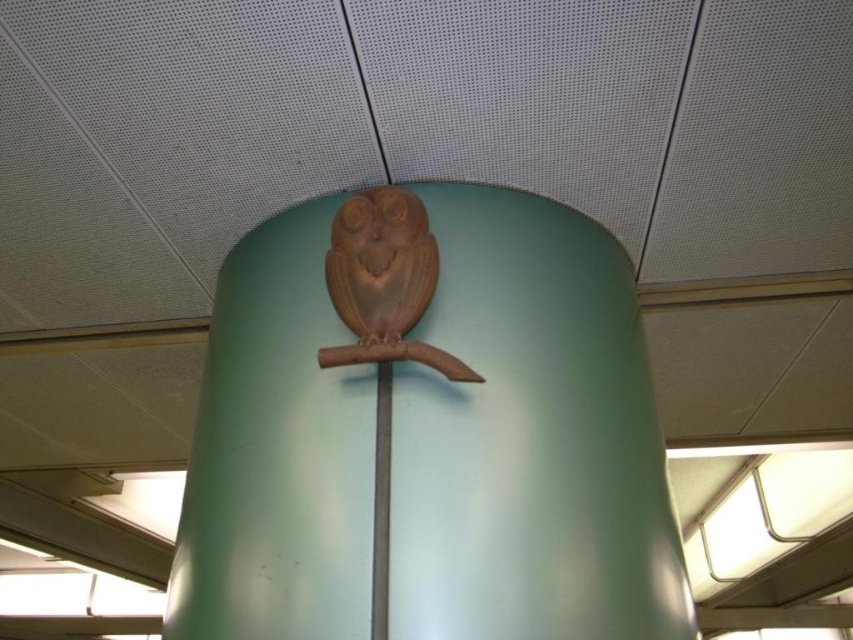
Measure the distance between point (671, 609) and camera.

Point (671, 609) is 3.73 feet away from camera.

Between matte wood owl at center and wooden owl at center, which one has less height?

Standing shorter between the two is wooden owl at center.

Image resolution: width=853 pixels, height=640 pixels. In order to click on matte wood owl at center in this screenshot , I will do `click(428, 429)`.

Identify the location of matte wood owl at center. (428, 429).

Who is positioned more to the right, wooden owl at center or metallic silver pole at center?

metallic silver pole at center is more to the right.

The width and height of the screenshot is (853, 640). Describe the element at coordinates (380, 262) in the screenshot. I see `wooden owl at center` at that location.

Which is in front, point (390, 230) or point (376, 632)?

Point (376, 632)

Find the location of `wooden owl at center`. wooden owl at center is located at coordinates (380, 262).

Is matte wood owl at center further to camera compared to metallic silver pole at center?

Yes, it is.

Does matte wood owl at center appear over metallic silver pole at center?

Yes, matte wood owl at center is above metallic silver pole at center.

What are the coordinates of `matte wood owl at center` in the screenshot? It's located at (428, 429).

Find the location of a particular element. matte wood owl at center is located at coordinates (428, 429).